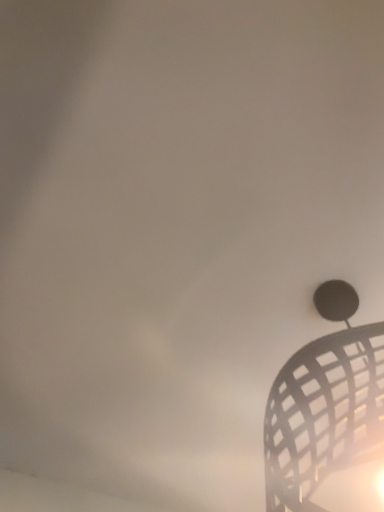
Based on the photo, measure the distance between point (370, 351) and camera.

The depth of point (370, 351) is 24.72 inches.

The width and height of the screenshot is (384, 512). Describe the element at coordinates (324, 405) in the screenshot. I see `matte black lampshade at right` at that location.

I want to click on matte black lampshade at right, so click(324, 405).

You are a GUI agent. You are given a task and a screenshot of the screen. Output one action in this format:
    pyautogui.click(x=<x>, y=<y>)
    Task: Click on the matte black lampshade at right
    
    Given the screenshot: What is the action you would take?
    pyautogui.click(x=324, y=405)